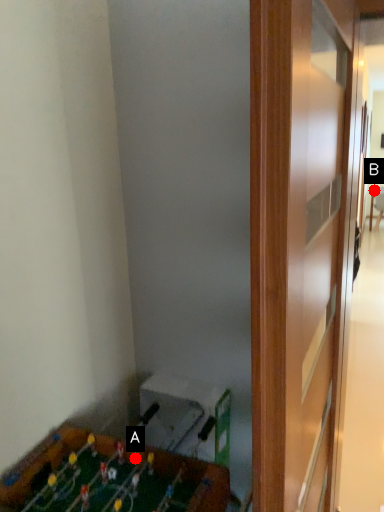
Question: Two points are circled on the image, labeled by A and B beside each circle. Which point is closer to the camera?

Choices:
 (A) A is closer
 (B) B is closer

Answer: (A)